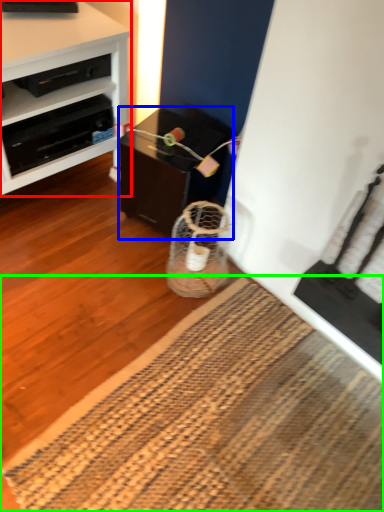
Question: Estimate the real-world distances between objects in this image. Which object is closer to desk (highlighted by a red box), table (highlighted by a blue box) or mat (highlighted by a green box)?

Choices:
 (A) table
 (B) mat

Answer: (A)